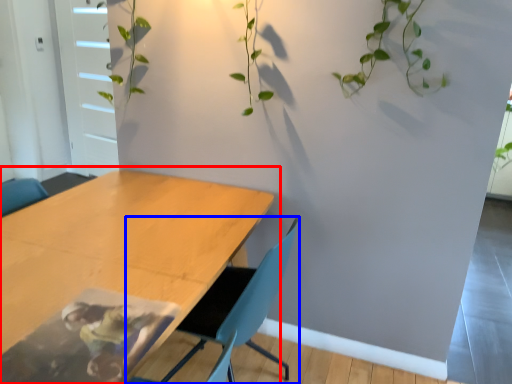
Question: Which object appears closest to the camera in this image, table (highlighted by a red box) or chair (highlighted by a blue box)?

Choices:
 (A) table
 (B) chair

Answer: (A)